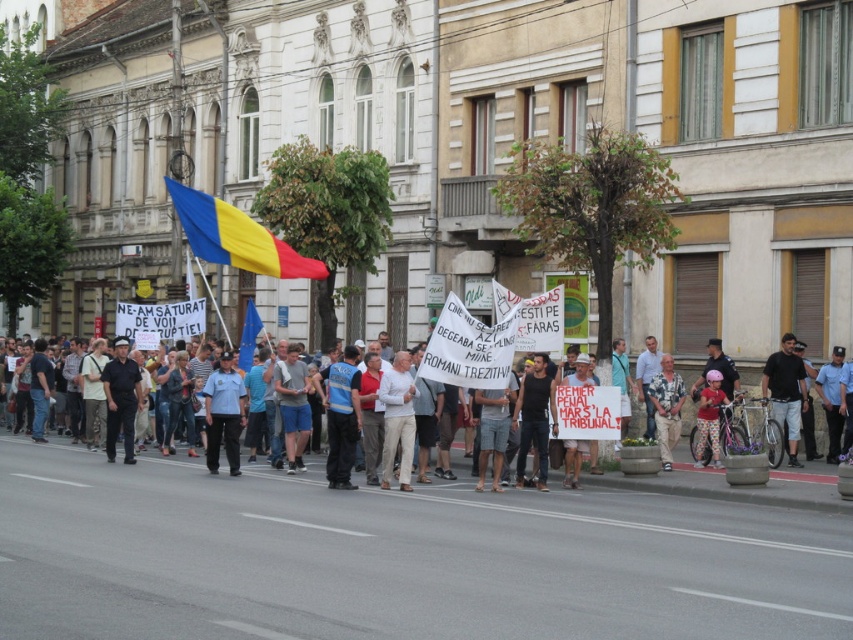
Does dark blue uniform at center have a lesser width compared to polka dot pants at lower right?

Incorrect, dark blue uniform at center's width is not less than polka dot pants at lower right's.

Who is more distant from viewer, (114, 372) or (717, 433)?

The point (114, 372) is behind.

This screenshot has height=640, width=853. Describe the element at coordinates (120, 397) in the screenshot. I see `dark blue uniform at center` at that location.

Find the location of a particular element. This screenshot has width=853, height=640. dark blue uniform at center is located at coordinates (120, 397).

Can you confirm if light blue uniform at center is shorter than blue fabric flag at center?

Yes, light blue uniform at center is shorter than blue fabric flag at center.

The height and width of the screenshot is (640, 853). Find the location of `light blue uniform at center`. light blue uniform at center is located at coordinates (727, 484).

Is blue/yellow fabric flag at upper center in front of blue fabric flag at center?

Yes, it is in front of blue fabric flag at center.

Which is more to the right, blue/yellow fabric flag at upper center or blue fabric flag at center?

From the viewer's perspective, blue/yellow fabric flag at upper center appears more on the right side.

Locate an element on the screen. Image resolution: width=853 pixels, height=640 pixels. blue/yellow fabric flag at upper center is located at coordinates (235, 236).